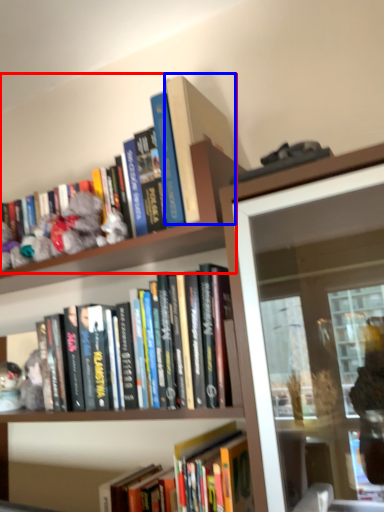
Question: Which of the following is the farthest to the observer, book (highlighted by a red box) or book (highlighted by a blue box)?

Choices:
 (A) book
 (B) book

Answer: (B)